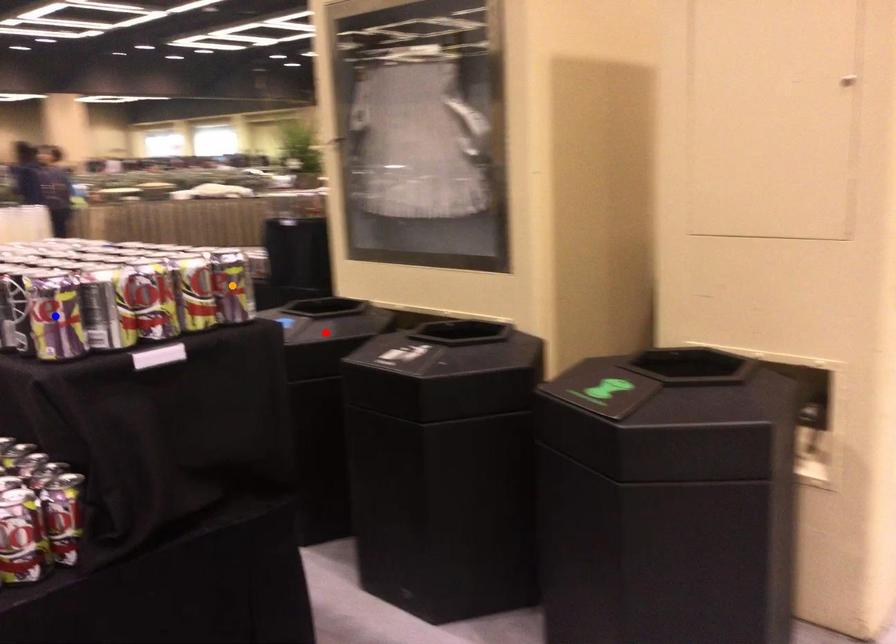
Order these from nearest to farthest:
blue point, red point, orange point

Result: blue point
orange point
red point